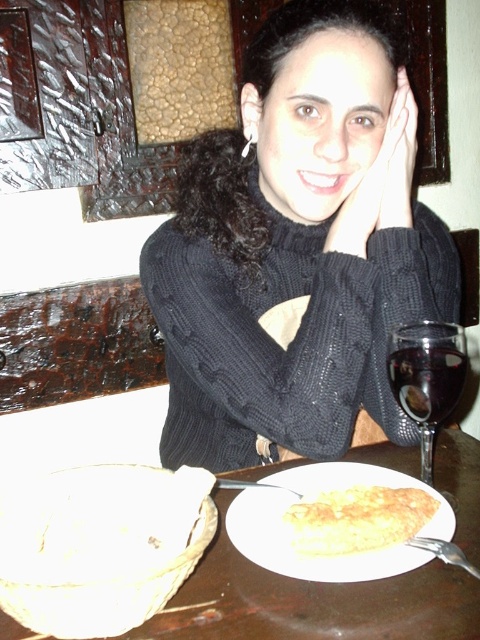
Question: Does black knitted sweater at center lie in front of yellowish matte omelette at center?

Choices:
 (A) yes
 (B) no

Answer: (B)

Question: Which object is closer to the camera taking this photo?

Choices:
 (A) yellowish matte omelette at center
 (B) wooden table at center
 (C) transparent glass wine at right

Answer: (B)

Question: Is black knitted sweater at center positioned in front of yellowish matte omelette at center?

Choices:
 (A) no
 (B) yes

Answer: (A)

Question: Which object appears farthest from the camera in this image?

Choices:
 (A) yellowish matte omelette at center
 (B) wooden table at center
 (C) transparent glass wine at right
 (D) black knitted sweater at center

Answer: (D)

Question: Is the position of wooden table at center less distant than that of transparent glass wine at right?

Choices:
 (A) no
 (B) yes

Answer: (B)

Question: Which point is closer to the camera?

Choices:
 (A) (354, 486)
 (B) (463, 433)
 (C) (420, 353)

Answer: (C)